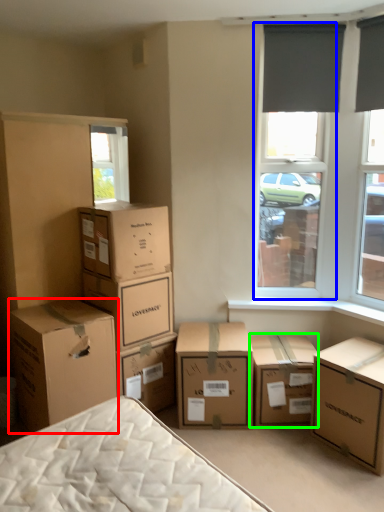
Question: Which object is the closest to the box (highlighted by a red box)? Choose among these: window screen (highlighted by a blue box) or box (highlighted by a green box).

Choices:
 (A) window screen
 (B) box

Answer: (B)